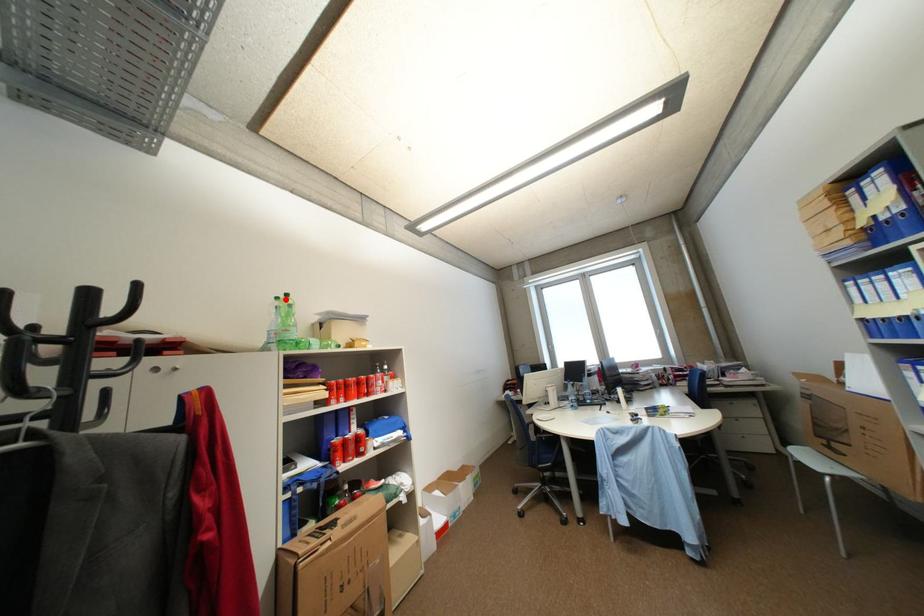
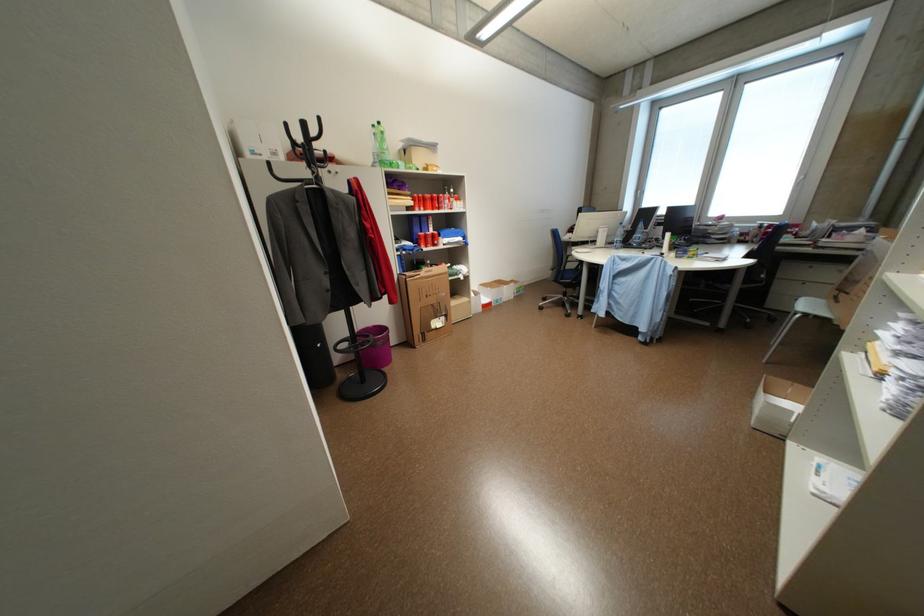
Find the pixel in the second image that matches the highlighted location in the first image.

(382, 127)